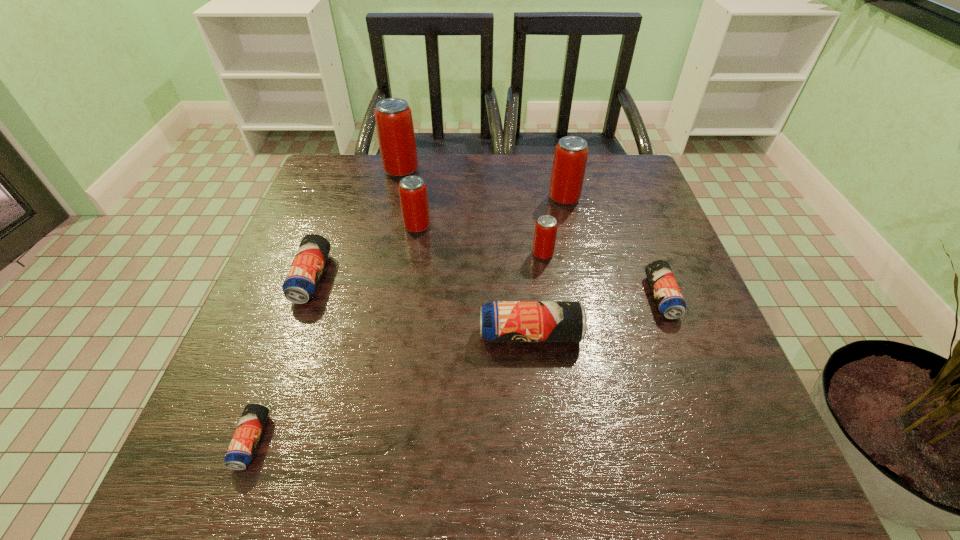
Locate an element on the screen. blank region between the fifth tallest beer can and the seventh shortest beer can is located at coordinates (547, 266).

Where is `blank region between the fourth shortest object and the fifth shortest object`? blank region between the fourth shortest object and the fifth shortest object is located at coordinates (537, 294).

The width and height of the screenshot is (960, 540). In order to click on free spot between the biggest pink beer can and the sixth tallest beer can in this screenshot , I will do `click(356, 224)`.

Find the location of a particular element. The height and width of the screenshot is (540, 960). vacant area that lies between the fifth tallest beer can and the second tallest beer can is located at coordinates (547, 266).

Select which object is the fifth closest to the farthest pink beer can. Please provide its 2D coordinates. Your answer should be formatted as a tuple, i.e. [(x, y)], where the tuple contains the x and y coordinates of a point satisfying the conditions above.

[(500, 321)]

You are a GUI agent. You are given a task and a screenshot of the screen. Output one action in this format:
    pyautogui.click(x=<x>, y=<y>)
    Task: Click on the object that stands as the seventh closest to the third pink beer can from left to right
    
    Given the screenshot: What is the action you would take?
    pyautogui.click(x=241, y=450)

Identify the location of the third closest beer can to the nearest beer can. (413, 195).

This screenshot has width=960, height=540. I want to click on beer can that stands as the fifth closest to the second smallest blue beer can, so click(393, 116).

Locate which pink beer can ranks third in proximity to the biggest blue beer can. Please provide its 2D coordinates. Your answer should be formatted as a tuple, i.e. [(x, y)], where the tuple contains the x and y coordinates of a point satisfying the conditions above.

[(570, 158)]

Identify which pink beer can is the fourth nearest to the shortest beer can. Please provide its 2D coordinates. Your answer should be formatted as a tuple, i.e. [(x, y)], where the tuple contains the x and y coordinates of a point satisfying the conditions above.

[(570, 158)]